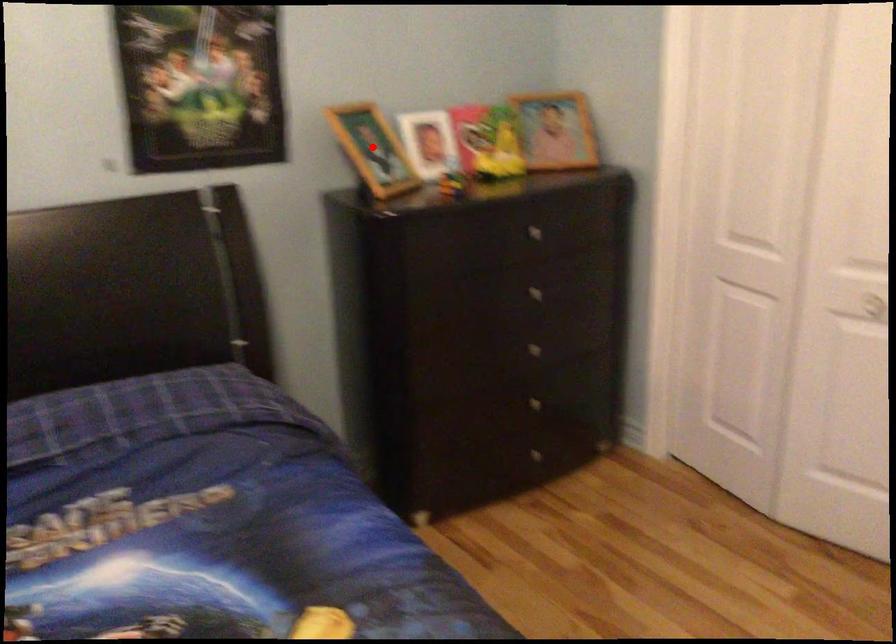
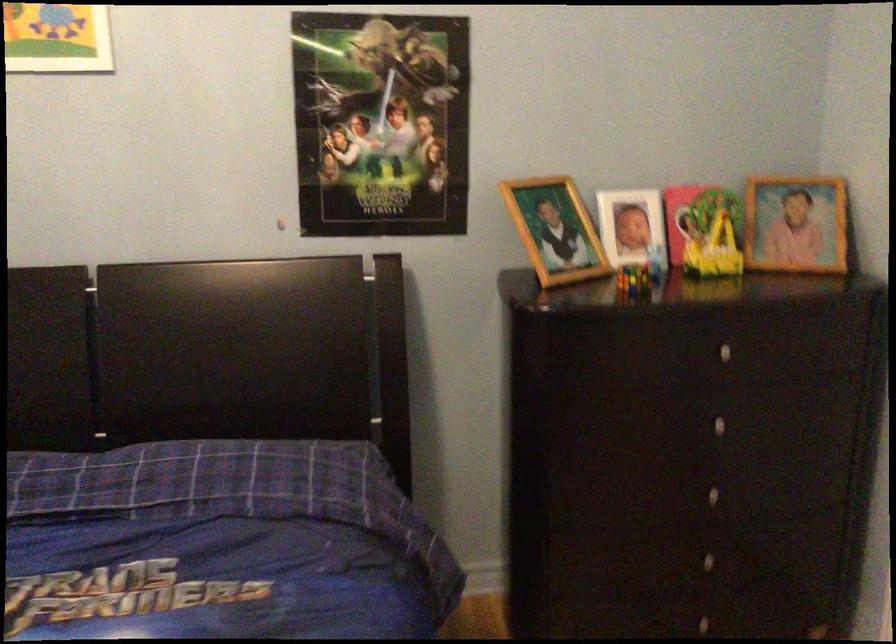
Question: I am providing you with two images of the same scene from different viewpoints. A red point is shown in image1. For the corresponding object point in image2, is it positioned nearer or farther from the camera?

Choices:
 (A) Nearer
 (B) Farther

Answer: (A)